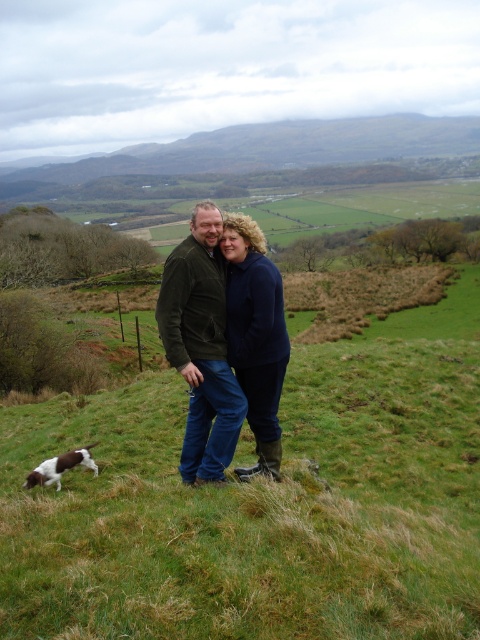
Question: Which of the following is the closest to the observer?

Choices:
 (A) (24, 180)
 (B) (36, 474)
 (C) (166, 304)
 (D) (444, 538)

Answer: (D)

Question: Does green grassy hillside at upper center appear under brown speckled fur at lower left?

Choices:
 (A) yes
 (B) no

Answer: (B)

Question: Observing the image, what is the correct spatial positioning of green grassy hillside at upper center in reference to dark green corduroy jacket at center?

Choices:
 (A) above
 (B) below

Answer: (A)

Question: Which object is positioned farthest from the brown speckled fur at lower left?

Choices:
 (A) green grassy hillside at upper center
 (B) green grassy hillside at center
 (C) dark green corduroy jacket at center

Answer: (A)

Question: Which point appears closest to the camera in this image?

Choices:
 (A) (68, 452)
 (B) (240, 132)
 (C) (217, 376)
 (D) (358, 564)

Answer: (D)

Question: Is green grassy hillside at upper center thinner than brown speckled fur at lower left?

Choices:
 (A) no
 (B) yes

Answer: (A)